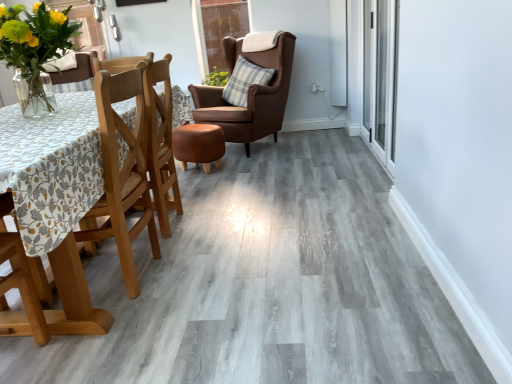
What do you see at coordinates (249, 95) in the screenshot? I see `brown leather wingback chair at center, positioned as the 1th chair in back-to-front order` at bounding box center [249, 95].

Describe the element at coordinates (34, 42) in the screenshot. I see `translucent glass vase with yellow flowers at left` at that location.

The height and width of the screenshot is (384, 512). What do you see at coordinates (106, 209) in the screenshot? I see `wooden chair at left, acting as the first chair starting from the front` at bounding box center [106, 209].

The height and width of the screenshot is (384, 512). In order to click on wooden chair at left, arranged as the second chair when viewed from the back in this screenshot , I will do `click(106, 209)`.

The height and width of the screenshot is (384, 512). What do you see at coordinates (380, 77) in the screenshot?
I see `transparent glass door at upper right, arranged as the second glass door when viewed from the left` at bounding box center [380, 77].

How much space does white soft pillow at upper left, placed as the 1th pillow when sorted from left to right, occupy horizontally?

It is 9.63 inches.

You are a GUI agent. You are given a task and a screenshot of the screen. Output one action in this format:
    pyautogui.click(x=<x>, y=<y>)
    Task: Click on the brown leather wingback chair at center, placed as the second chair when sorted from bottom to top
    
    Given the screenshot: What is the action you would take?
    pyautogui.click(x=249, y=95)

Considering the sizes of brown leather wingback chair at center, which is counted as the 2th chair, starting from the front, and wooden chair at left, acting as the first chair starting from the front, in the image, is brown leather wingback chair at center, which is counted as the 2th chair, starting from the front, bigger or smaller than wooden chair at left, acting as the first chair starting from the front,?

In the image, brown leather wingback chair at center, which is counted as the 2th chair, starting from the front, appears to be larger than wooden chair at left, acting as the first chair starting from the front.

Considering the positions of points (245, 134) and (100, 311), is point (245, 134) closer to camera compared to point (100, 311)?

No, it is behind (100, 311).

Is brown leather wingback chair at center, positioned as the 1th chair in back-to-front order, not within wooden chair at left, arranged as the 1th chair when ordered from the bottom?

Indeed, brown leather wingback chair at center, positioned as the 1th chair in back-to-front order, is completely outside wooden chair at left, arranged as the 1th chair when ordered from the bottom.

Is brown leather wingback chair at center, which is counted as the 2th chair, starting from the front, far away from wooden chair at left, acting as the first chair starting from the front?

Yes, brown leather wingback chair at center, which is counted as the 2th chair, starting from the front, and wooden chair at left, acting as the first chair starting from the front, are located far from each other.

Find the location of a particular element. The image size is (512, 384). floral arrangement located on the right of white soft pillow at upper left, acting as the second pillow starting from the right is located at coordinates (34, 42).

Is translucent glass vase with yellow flowers at left at the back of white soft pillow at upper left, placed as the 1th pillow when sorted from left to right?

That's not correct — white soft pillow at upper left, placed as the 1th pillow when sorted from left to right, is not looking away from translucent glass vase with yellow flowers at left.

Considering the sizes of objects white soft pillow at upper left, placed as the 1th pillow when sorted from left to right, and translucent glass vase with yellow flowers at left in the image provided, who is bigger, white soft pillow at upper left, placed as the 1th pillow when sorted from left to right, or translucent glass vase with yellow flowers at left?

With larger size is translucent glass vase with yellow flowers at left.

Consider the image. From the image's perspective, does wooden chair at left, acting as the first chair starting from the front, appear lower than translucent glass vase with yellow flowers at left?

Correct, wooden chair at left, acting as the first chair starting from the front, appears lower than translucent glass vase with yellow flowers at left in the image.

I want to click on chair lying below the translucent glass vase with yellow flowers at left (from the image's perspective), so click(106, 209).

How distant is wooden chair at left, acting as the first chair starting from the front, from translucent glass vase with yellow flowers at left?

The distance of wooden chair at left, acting as the first chair starting from the front, from translucent glass vase with yellow flowers at left is 25.40 inches.

Does point (82, 272) come behind point (55, 45)?

That is False.

From a real-world perspective, does transparent glass door at upper right, which ranks as the second glass door in back-to-front order, sit lower than wooden chair at left, arranged as the second chair when viewed from the back?

Incorrect, from a real-world perspective, transparent glass door at upper right, which ranks as the second glass door in back-to-front order, is higher than wooden chair at left, arranged as the second chair when viewed from the back.

Where is `the 2nd glass door counting from the right side of the wooden chair at left, arranged as the 1th chair when ordered from the bottom`? The image size is (512, 384). the 2nd glass door counting from the right side of the wooden chair at left, arranged as the 1th chair when ordered from the bottom is located at coordinates (380, 77).

Is transparent glass door at upper right, the 1th glass door in the right-to-left sequence, taller or shorter than wooden chair at left, arranged as the second chair when viewed from the back?

transparent glass door at upper right, the 1th glass door in the right-to-left sequence, is taller than wooden chair at left, arranged as the second chair when viewed from the back.

Is wooden chair at left, arranged as the second chair when viewed from the back, located within transparent glass door at upper right, arranged as the second glass door when viewed from the left?

That's incorrect, wooden chair at left, arranged as the second chair when viewed from the back, is not inside transparent glass door at upper right, arranged as the second glass door when viewed from the left.

Does transparent glass door at upper center, the first glass door from the back, turn towards brown leather wingback chair at center, placed as the first chair when sorted from top to bottom?

Yes, transparent glass door at upper center, the first glass door from the back, is turned towards brown leather wingback chair at center, placed as the first chair when sorted from top to bottom.

Is brown leather wingback chair at center, which is counted as the 2th chair, starting from the front, completely or partially inside transparent glass door at upper center, which is counted as the 1th glass door, starting from the left?

No.

From the picture: From the image's perspective, is transparent glass door at upper center, which is counted as the 1th glass door, starting from the left, located above or below brown leather wingback chair at center, which is counted as the 2th chair, starting from the front?

From the image's perspective, transparent glass door at upper center, which is counted as the 1th glass door, starting from the left, appears above brown leather wingback chair at center, which is counted as the 2th chair, starting from the front.

How different are the orientations of transparent glass door at upper center, the first glass door from the back, and brown leather wingback chair at center, placed as the first chair when sorted from top to bottom, in degrees?

They differ by 32.6 degrees in their facing directions.

Does brown leather wingback chair at center, placed as the first chair when sorted from top to bottom, appear on the left side of plaid fabric pillow at center, which is the 2th pillow from left to right?

Correct, you'll find brown leather wingback chair at center, placed as the first chair when sorted from top to bottom, to the left of plaid fabric pillow at center, which is the 2th pillow from left to right.

From the image's perspective, between brown leather wingback chair at center, which is counted as the 2th chair, starting from the front, and plaid fabric pillow at center, marked as the 1th pillow in a right-to-left arrangement, which one is located above?

plaid fabric pillow at center, marked as the 1th pillow in a right-to-left arrangement, appears higher in the image.

Are brown leather wingback chair at center, positioned as the 1th chair in back-to-front order, and plaid fabric pillow at center, marked as the 1th pillow in a right-to-left arrangement, far apart?

They are positioned close to each other.

Find the location of a particular element. pillow on the right of brown leather wingback chair at center, placed as the first chair when sorted from top to bottom is located at coordinates (245, 81).

Consider the image. Is white soft pillow at upper left, acting as the second pillow starting from the right, positioned far away from transparent glass door at upper center, the second glass door in the front-to-back sequence?

That's right, there is a large distance between white soft pillow at upper left, acting as the second pillow starting from the right, and transparent glass door at upper center, the second glass door in the front-to-back sequence.

Is white soft pillow at upper left, acting as the second pillow starting from the right, smaller than transparent glass door at upper center, arranged as the 2th glass door when viewed from the right?

Correct, white soft pillow at upper left, acting as the second pillow starting from the right, occupies less space than transparent glass door at upper center, arranged as the 2th glass door when viewed from the right.

Is white soft pillow at upper left, acting as the second pillow starting from the right, completely or partially outside of transparent glass door at upper center, which is counted as the 1th glass door, starting from the left?

Indeed, white soft pillow at upper left, acting as the second pillow starting from the right, is completely outside transparent glass door at upper center, which is counted as the 1th glass door, starting from the left.

Identify the location of chair above the wooden chair at left, which is the 2th chair in top-to-bottom order (from a real-world perspective). The image size is (512, 384). (249, 95).

You are a GUI agent. You are given a task and a screenshot of the screen. Output one action in this format:
    pyautogui.click(x=<x>, y=<y>)
    Task: Click on the 1st pillow positioned below the translucent glass vase with yellow flowers at left (from a real-world perspective)
    Image resolution: width=512 pixels, height=384 pixels.
    Given the screenshot: What is the action you would take?
    pyautogui.click(x=61, y=62)

From the image, which object appears to be nearer to white soft pillow at upper left, placed as the 1th pillow when sorted from left to right, brown leather wingback chair at center, placed as the first chair when sorted from top to bottom, or transparent glass door at upper right, placed as the 1th glass door when sorted from front to back?

Among the two, brown leather wingback chair at center, placed as the first chair when sorted from top to bottom, is located nearer to white soft pillow at upper left, placed as the 1th pillow when sorted from left to right.

When comparing their distances from transparent glass door at upper center, which is counted as the 1th glass door, starting from the left, does plaid fabric pillow at center, which is the 2th pillow from left to right, or brown leather wingback chair at center, placed as the first chair when sorted from top to bottom, seem closer?

brown leather wingback chair at center, placed as the first chair when sorted from top to bottom, lies closer to transparent glass door at upper center, which is counted as the 1th glass door, starting from the left, than the other object.

From the image, which object appears to be nearer to transparent glass door at upper center, arranged as the 2th glass door when viewed from the right, plaid fabric pillow at center, which is the 2th pillow from left to right, or transparent glass door at upper right, which ranks as the second glass door in back-to-front order?

plaid fabric pillow at center, which is the 2th pillow from left to right.

From the image, which object appears to be nearer to translucent glass vase with yellow flowers at left, white soft pillow at upper left, acting as the second pillow starting from the right, or transparent glass door at upper center, the first glass door from the back?

Based on the image, white soft pillow at upper left, acting as the second pillow starting from the right, appears to be nearer to translucent glass vase with yellow flowers at left.

Considering their positions, is transparent glass door at upper right, arranged as the second glass door when viewed from the left, positioned further to brown leather wingback chair at center, which is counted as the 2th chair, starting from the front, than translucent glass vase with yellow flowers at left?

Based on the image, translucent glass vase with yellow flowers at left appears to be further to brown leather wingback chair at center, which is counted as the 2th chair, starting from the front.

When comparing their distances from plaid fabric pillow at center, which is the 2th pillow from left to right, does transparent glass door at upper right, arranged as the second glass door when viewed from the left, or translucent glass vase with yellow flowers at left seem further?

Among the two, translucent glass vase with yellow flowers at left is located further to plaid fabric pillow at center, which is the 2th pillow from left to right.

Looking at the image, which one is located closer to transparent glass door at upper center, arranged as the 2th glass door when viewed from the right, wooden chair at left, which is the 2th chair in top-to-bottom order, or translucent glass vase with yellow flowers at left?

translucent glass vase with yellow flowers at left lies closer to transparent glass door at upper center, arranged as the 2th glass door when viewed from the right, than the other object.

Considering their positions, is plaid fabric pillow at center, marked as the 1th pillow in a right-to-left arrangement, positioned closer to white soft pillow at upper left, acting as the second pillow starting from the right, than translucent glass vase with yellow flowers at left?

plaid fabric pillow at center, marked as the 1th pillow in a right-to-left arrangement.

Locate an element on the screen. This screenshot has width=512, height=384. glass door between white soft pillow at upper left, acting as the second pillow starting from the right, and brown leather wingback chair at center, positioned as the 1th chair in back-to-front order, in the horizontal direction is located at coordinates (217, 29).

Locate an element on the screen. chair between transparent glass door at upper right, placed as the 1th glass door when sorted from front to back, and transparent glass door at upper center, the second glass door in the front-to-back sequence, from front to back is located at coordinates (249, 95).

Locate an element on the screen. chair between wooden chair at left, arranged as the 1th chair when ordered from the bottom, and white soft pillow at upper left, acting as the second pillow starting from the right, from front to back is located at coordinates (249, 95).

Locate an element on the screen. Image resolution: width=512 pixels, height=384 pixels. chair located between transparent glass door at upper right, arranged as the second glass door when viewed from the left, and plaid fabric pillow at center, which is the 2th pillow from left to right, in the depth direction is located at coordinates (249, 95).